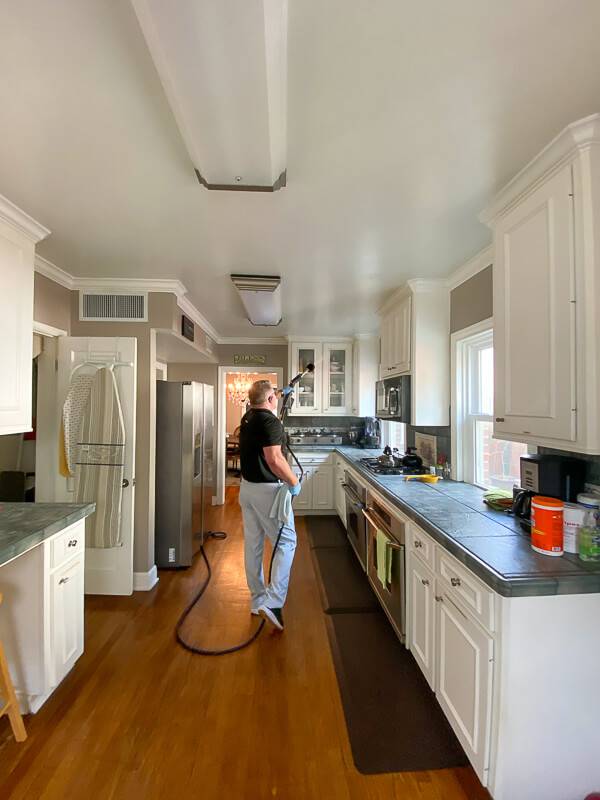
At what (x,y) coordinates should I click in order to perform the action: click on green towel hanging on oven door handle. Please return your answer as a coordinate pair (x, y). This screenshot has width=600, height=800. Looking at the image, I should click on (381, 562).